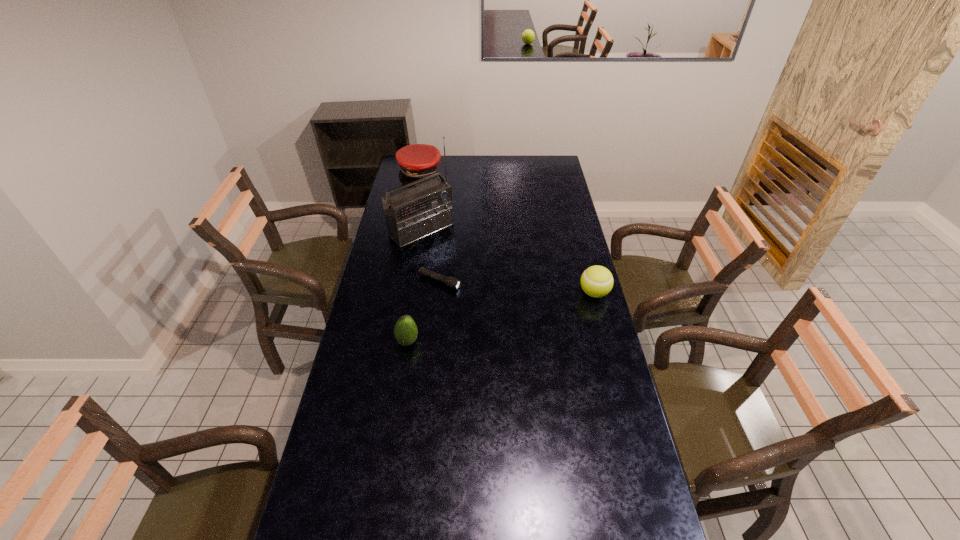
Where is `free spot that satisfies the following two spatial constraints: 1. on the front side of the farthest object; 2. on the left side of the radio receiver`? The height and width of the screenshot is (540, 960). free spot that satisfies the following two spatial constraints: 1. on the front side of the farthest object; 2. on the left side of the radio receiver is located at coordinates 409,230.

Find the location of a particular element. Image resolution: width=960 pixels, height=540 pixels. vacant region that satisfies the following two spatial constraints: 1. on the back side of the nearest object; 2. on the right side of the tennis ball is located at coordinates (415, 293).